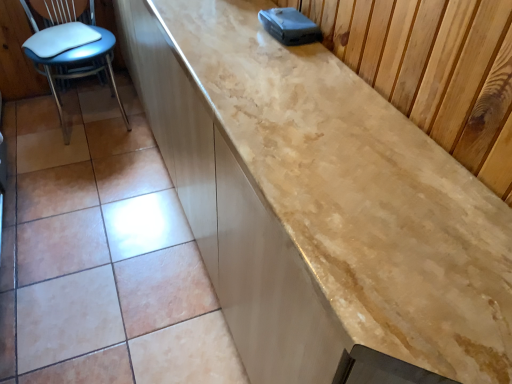
The width and height of the screenshot is (512, 384). What do you see at coordinates (73, 49) in the screenshot?
I see `blue plastic chair at left` at bounding box center [73, 49].

This screenshot has height=384, width=512. I want to click on blue plastic chair at left, so click(73, 49).

Where is `blue plastic chair at left`? The image size is (512, 384). blue plastic chair at left is located at coordinates (73, 49).